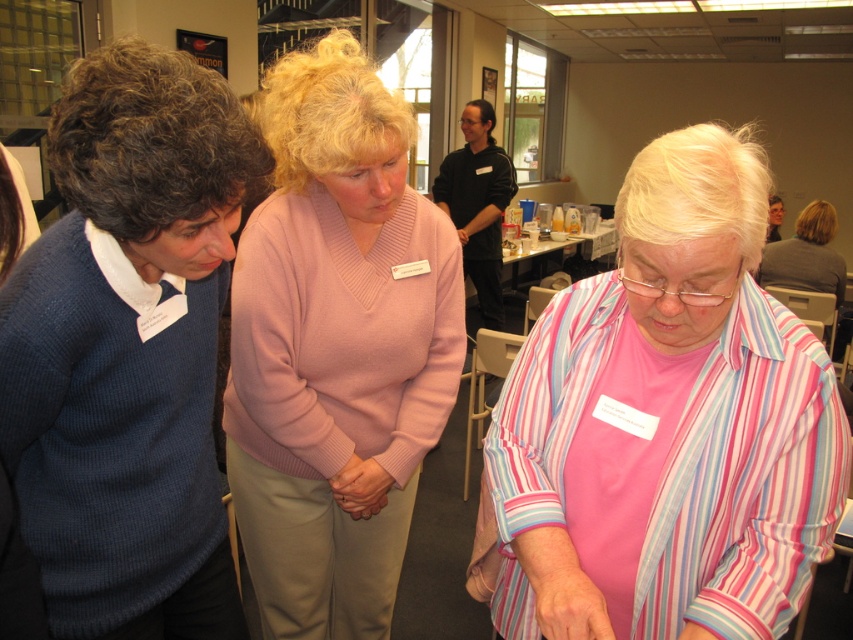
You are a tailor observing the women in the image. You need to determine which of the two garments, the pink striped shirt at center or the dark blue ribbed sweater at left, requires more fabric for alterations. Based on their sizes, which garment should you prioritize?

The dark blue ribbed sweater at left requires more fabric for alterations since it is taller than the pink striped shirt at center.

You are a photographer setting up for a group photo. You need to ensure that the pink striped shirt at center and the pink sweater at center are both visible in the frame. Which clothing item should you adjust to avoid being blocked by the other?

The pink striped shirt at center is shorter than the pink sweater at center, so you should adjust the pink sweater at center to avoid blocking the pink striped shirt at center.

You are a photographer standing between the pink striped shirt at center and the dark blue ribbed sweater at left. You need to take a photo that includes both subjects. Given that your camera has a maximum focus range of 20 inches, will you be able to capture both in focus?

The distance between the pink striped shirt at center and the dark blue ribbed sweater at left is 19.99 inches, which is within the camera maximum focus range of 20 inches. Therefore, you can capture both subjects in focus.